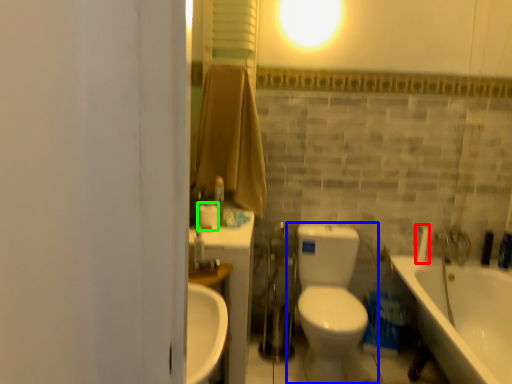
Question: Which object is the farthest from plumbing fixture (highlighted by a red box)? Choose among these: toilet (highlighted by a blue box) or toilet paper (highlighted by a green box).

Choices:
 (A) toilet
 (B) toilet paper

Answer: (B)